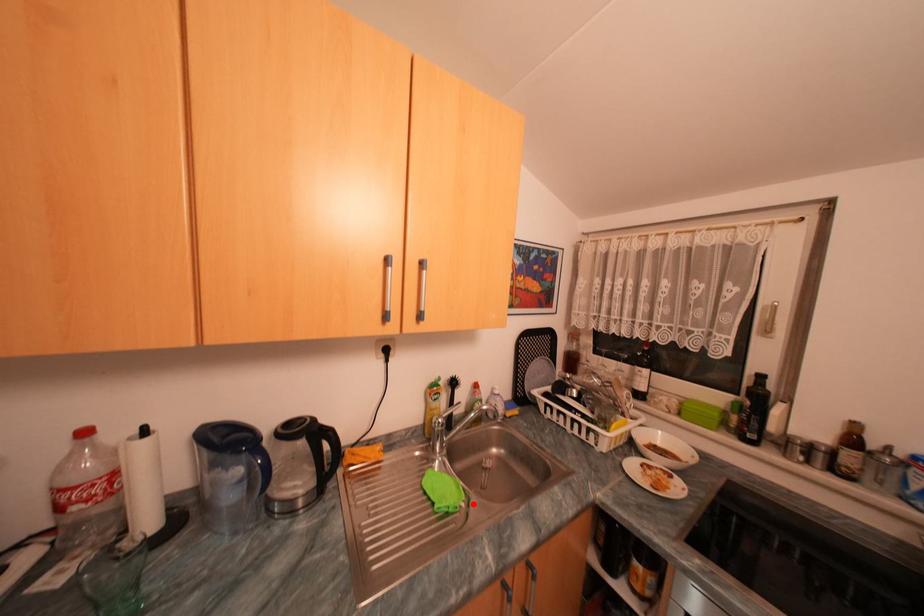
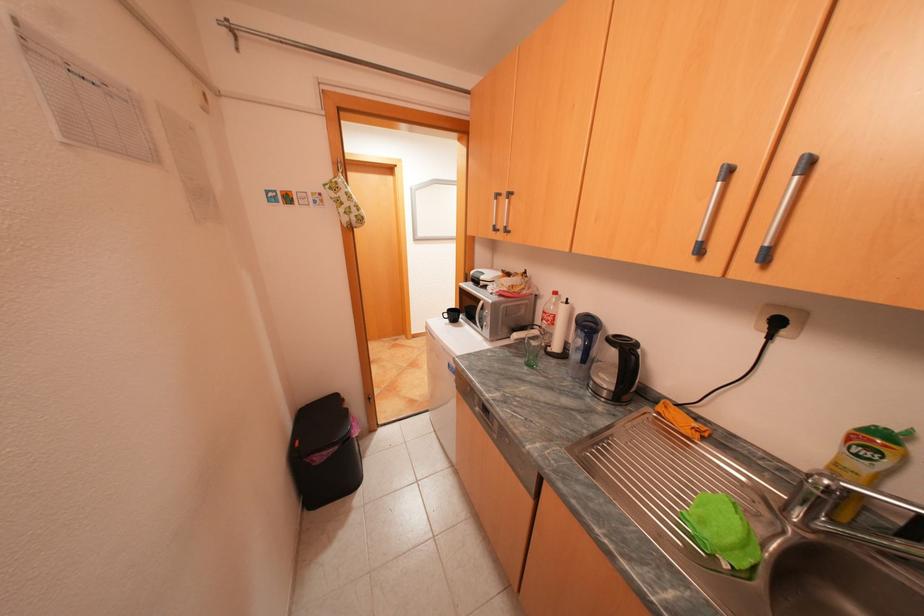
The point at the highlighted location is marked in the first image. Where is the corresponding point in the second image?

(736, 565)